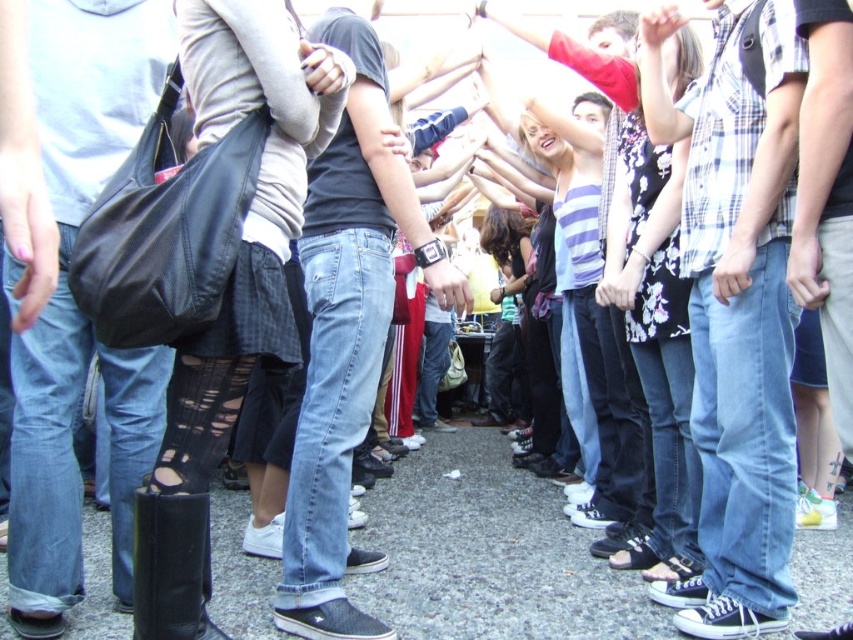
Question: Does plaid cotton shirt at center have a larger size compared to matte black bag at left?

Choices:
 (A) no
 (B) yes

Answer: (B)

Question: Can you confirm if plaid cotton shirt at center is bigger than jeans at center?

Choices:
 (A) yes
 (B) no

Answer: (B)

Question: Is plaid cotton shirt at center to the right of jeans at center from the viewer's perspective?

Choices:
 (A) no
 (B) yes

Answer: (B)

Question: Which point is farther from the camera taking this photo?

Choices:
 (A) (306, 384)
 (B) (107, 24)
 (C) (752, 109)

Answer: (A)

Question: Which object is farther from the camera taking this photo?

Choices:
 (A) jeans at center
 (B) plaid cotton shirt at center

Answer: (A)

Question: Estimate the real-world distances between objects in this image. Which object is farther from the plaid cotton shirt at center?

Choices:
 (A) matte black bag at left
 (B) jeans at center

Answer: (A)